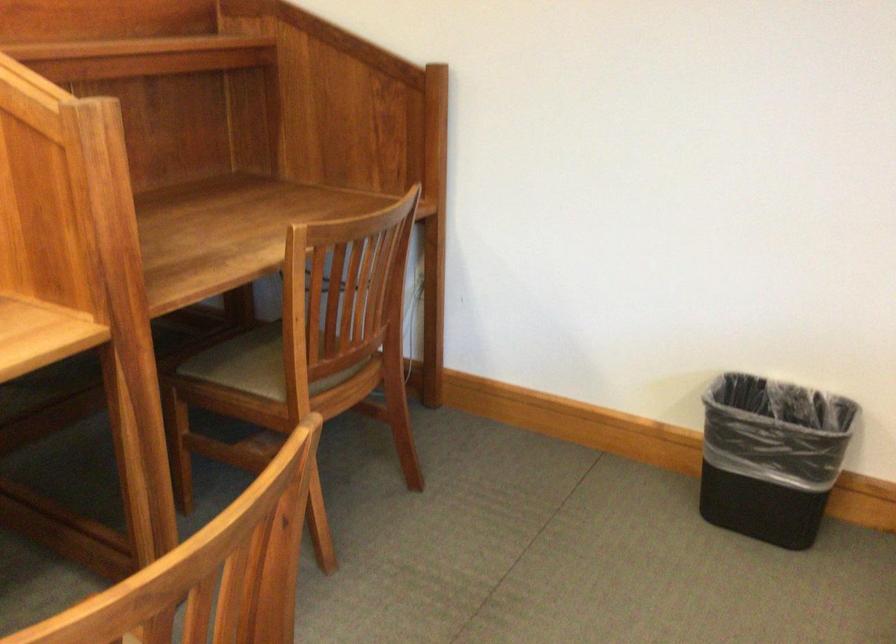
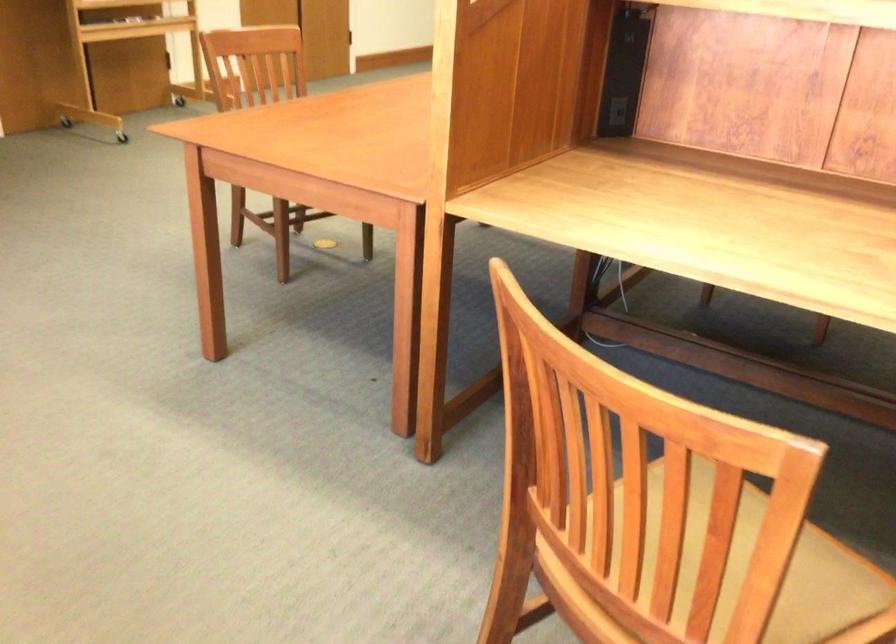
The images are taken continuously from a first-person perspective. In which direction is your viewpoint rotating?

The camera rotated toward left-down.